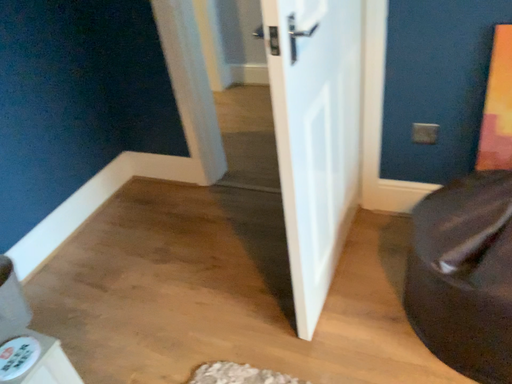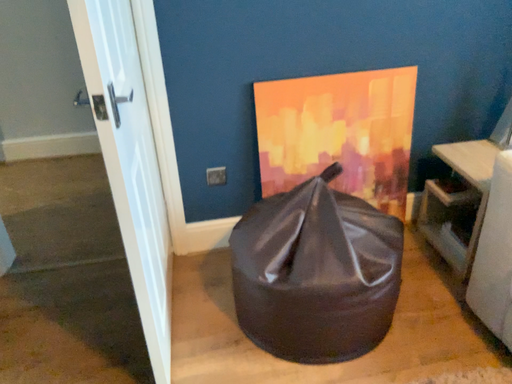
Question: How did the camera likely rotate when shooting the video?

Choices:
 (A) rotated left
 (B) rotated right

Answer: (B)